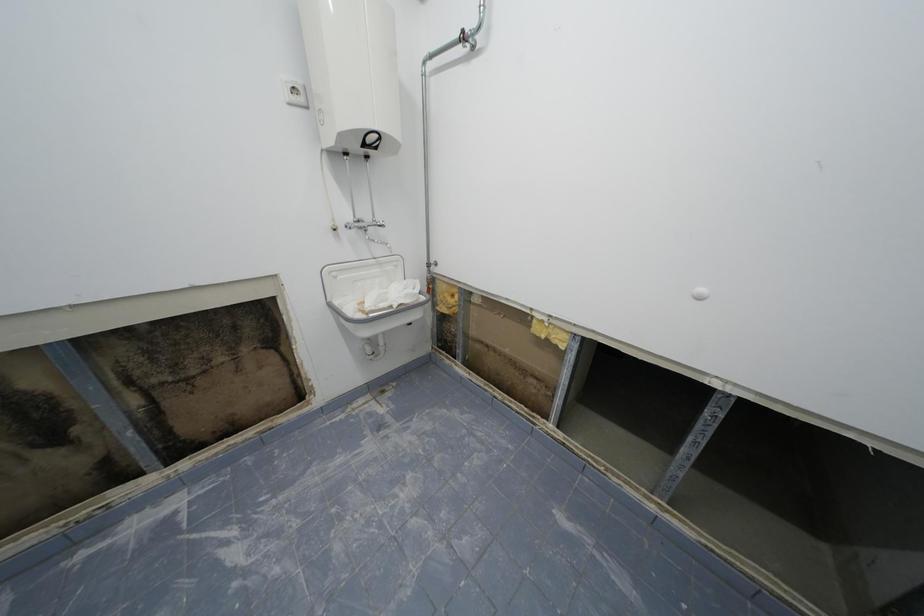
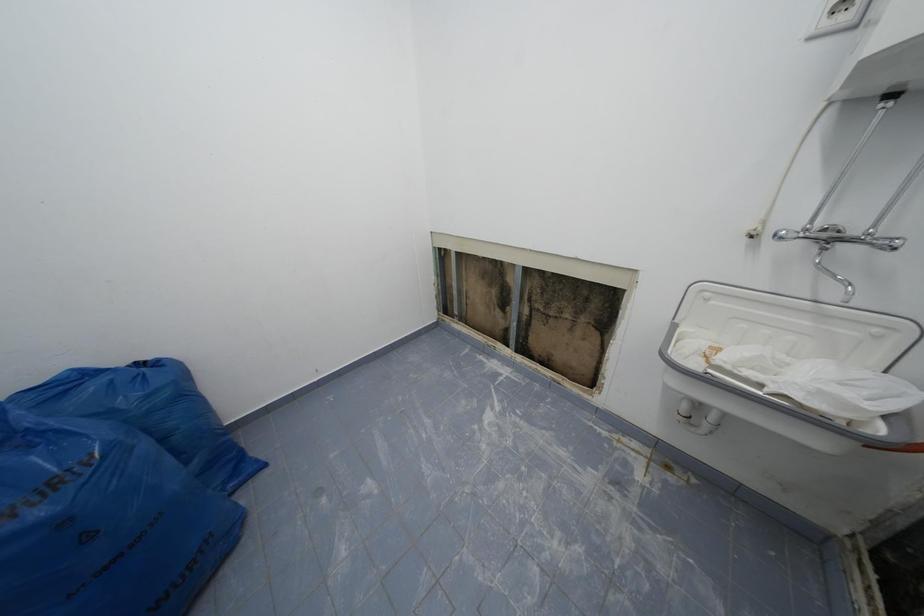
The first image is from the beginning of the video and the second image is from the end. How did the camera likely rotate when shooting the video?

The rotation direction of the camera is left-down.